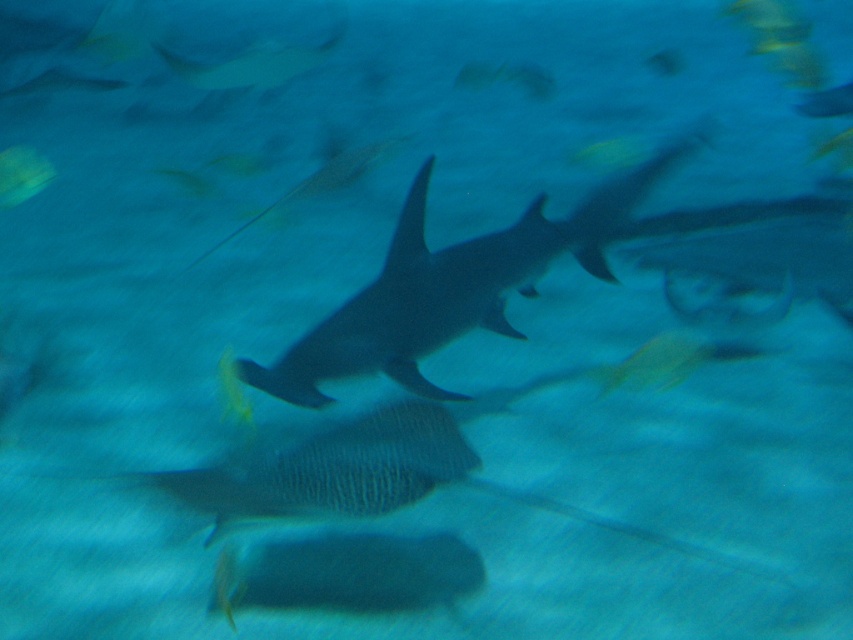
From the picture: Is gray matte shark at center closer to camera compared to translucent yellow fish at upper left?

Yes, gray matte shark at center is closer to the viewer.

This screenshot has width=853, height=640. Describe the element at coordinates (451, 288) in the screenshot. I see `gray matte shark at center` at that location.

What do you see at coordinates (451, 288) in the screenshot? I see `gray matte shark at center` at bounding box center [451, 288].

At what (x,y) coordinates should I click in order to perform the action: click on gray matte shark at center. Please return your answer as a coordinate pair (x, y). The width and height of the screenshot is (853, 640). Looking at the image, I should click on (451, 288).